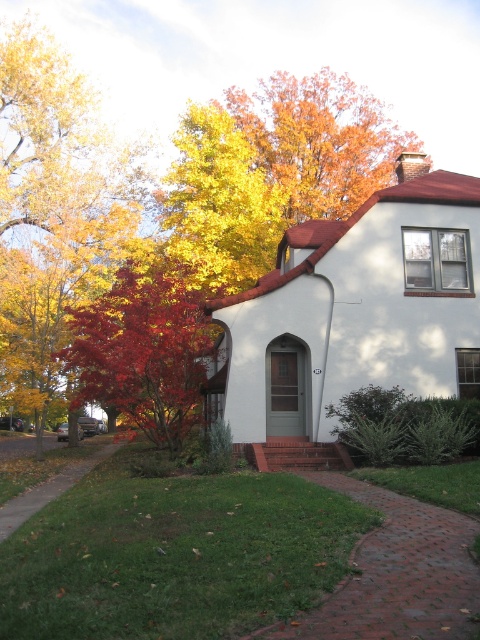
Looking at this image, between shiny red maple tree at left and orange leafy tree at upper center, which one is positioned lower?

shiny red maple tree at left is below.

Does shiny red maple tree at left appear over orange leafy tree at upper center?

Incorrect, shiny red maple tree at left is not positioned above orange leafy tree at upper center.

Which is in front, point (105, 365) or point (343, 141)?

Point (105, 365)

You are a GUI agent. You are given a task and a screenshot of the screen. Output one action in this format:
    pyautogui.click(x=<x>, y=<y>)
    Task: Click on the shiny red maple tree at left
    The width and height of the screenshot is (480, 640).
    Given the screenshot: What is the action you would take?
    pyautogui.click(x=143, y=352)

Which is in front, point (392, 124) or point (176, 132)?

Point (392, 124)

Describe the element at coordinates (320, 140) in the screenshot. The width and height of the screenshot is (480, 640). I see `orange leafy tree at upper center` at that location.

I want to click on orange leafy tree at upper center, so click(x=320, y=140).

Measure the distance between shiny red maple tree at left and golden leafy tree at upper center.

They are 6.35 meters apart.

Who is more forward, (166, 333) or (243, 147)?

Positioned in front is point (166, 333).

Where is `shiny red maple tree at left`? This screenshot has width=480, height=640. shiny red maple tree at left is located at coordinates tap(143, 352).